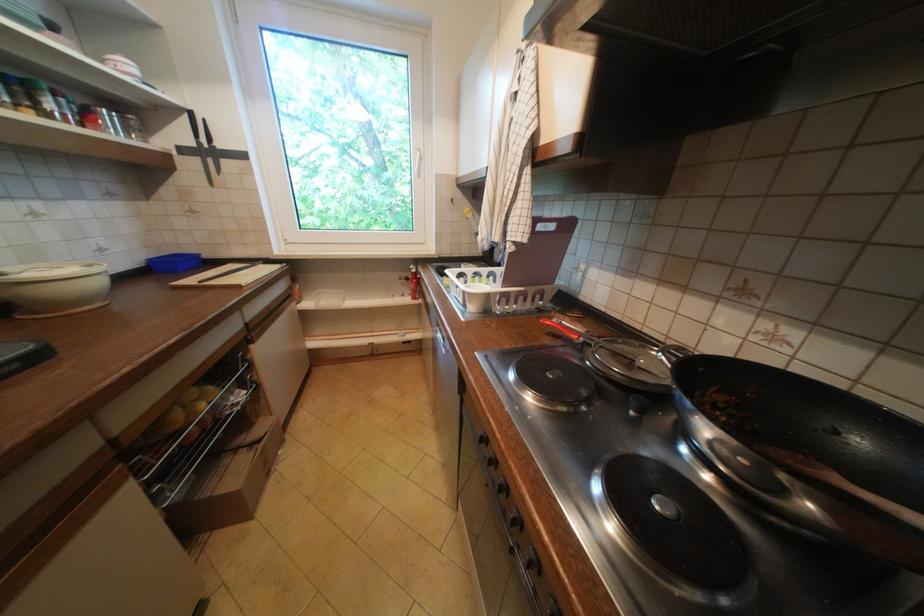
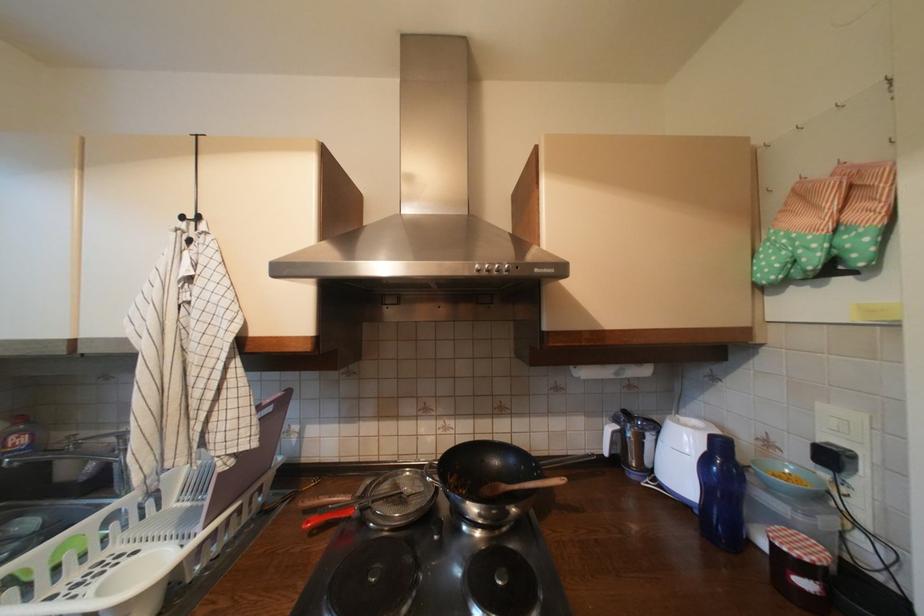
Find the pixel in the second image that matches pixel 642 362 in the first image.

(410, 495)